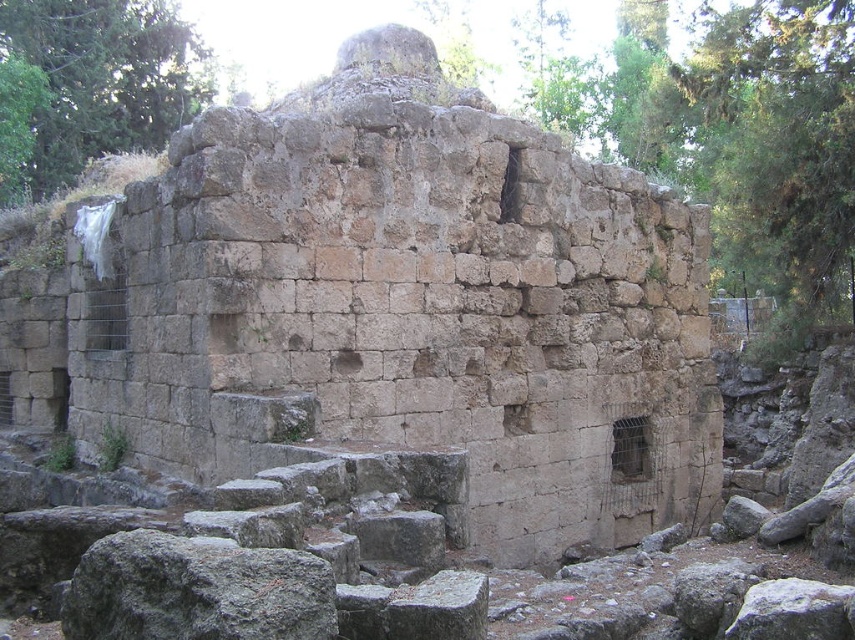
You are standing in front of the ancient stone structure. You notice a gray rough rock at lower left and rustic stone ruins at center. Which object is closer to you?

The gray rough rock at lower left is closer to you because the rustic stone ruins at center are further away.

You are an archaeologist examining the ancient site. You need to determine if the rustic stone ruins at center can fit entirely within the space occupied by the gray rough rock at lower left. Based on their widths, what would you conclude?

The rustic stone ruins at center might be wider than gray rough rock at lower left, so it is possible that the ruins cannot fit entirely within the space of the gray rough rock at lower left due to their potentially greater width.